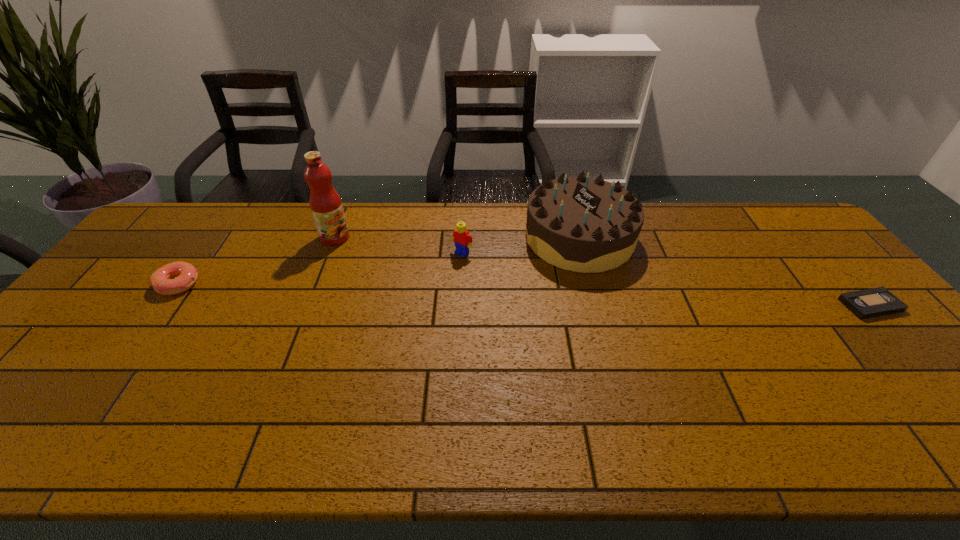
At what (x,y) coordinates should I click in order to perform the action: click on the second shortest object. Please return your answer as a coordinate pair (x, y). Looking at the image, I should click on (185, 274).

Identify the location of the leftmost object. The image size is (960, 540). (185, 274).

You are a GUI agent. You are given a task and a screenshot of the screen. Output one action in this format:
    pyautogui.click(x=<x>, y=<y>)
    Task: Click on the rightmost object
    
    Given the screenshot: What is the action you would take?
    pyautogui.click(x=868, y=303)

You are a GUI agent. You are given a task and a screenshot of the screen. Output one action in this format:
    pyautogui.click(x=<x>, y=<y>)
    Task: Click on the videotape
    
    Given the screenshot: What is the action you would take?
    pyautogui.click(x=868, y=303)

Locate an element on the screen. The image size is (960, 540). the tallest object is located at coordinates (326, 206).

The image size is (960, 540). What are the coordinates of `the second object from left to right` in the screenshot? It's located at (326, 206).

Find the location of a particular element. The image size is (960, 540). the second tallest object is located at coordinates (580, 224).

Identify the location of birthday cake. The height and width of the screenshot is (540, 960). (580, 224).

Image resolution: width=960 pixels, height=540 pixels. I want to click on the third tallest object, so click(462, 239).

In order to click on Lego in this screenshot , I will do `click(462, 239)`.